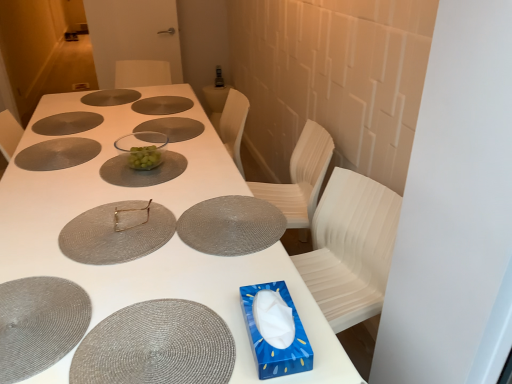
The image size is (512, 384). Identify the location of free space between matte gray glass plate at upper left, the third glass plate in the back-to-front sequence, and matte gray placemat at center, placed as the seventh glass plate when sorted from back to front. (119, 151).